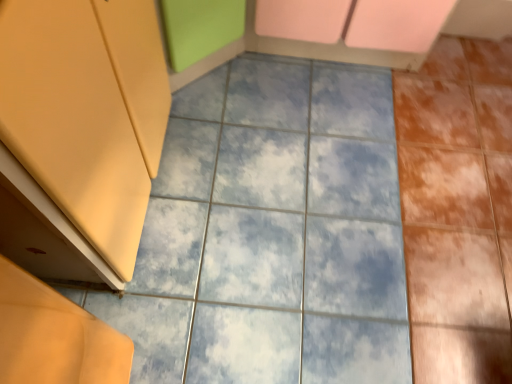
Question: Is matte yellow cabinet at left wider or thinner than blue marble tile at center?

Choices:
 (A) thin
 (B) wide

Answer: (A)

Question: Is matte yellow cabinet at left inside the boundaries of blue marble tile at center, or outside?

Choices:
 (A) outside
 (B) inside

Answer: (A)

Question: From the image's perspective, is matte yellow cabinet at left positioned above or below blue marble tile at center?

Choices:
 (A) above
 (B) below

Answer: (A)

Question: Considering their positions, is blue marble tile at center located in front of or behind matte yellow cabinet at left?

Choices:
 (A) front
 (B) behind

Answer: (B)

Question: In the image, is blue marble tile at center on the left side or the right side of matte yellow cabinet at left?

Choices:
 (A) right
 (B) left

Answer: (A)

Question: Is point (139, 347) closer or farther from the camera than point (138, 198)?

Choices:
 (A) closer
 (B) farther

Answer: (A)

Question: From the image's perspective, relative to matte yellow cabinet at left, is blue marble tile at center above or below?

Choices:
 (A) above
 (B) below

Answer: (B)